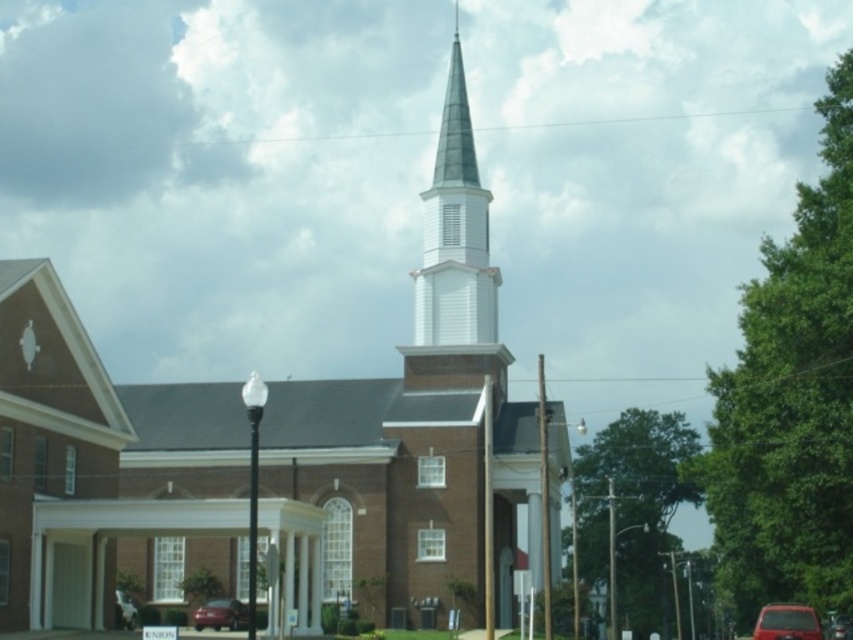
Question: Is the position of white wood steeple at center more distant than that of matte red car at lower right?

Choices:
 (A) no
 (B) yes

Answer: (B)

Question: From the image, what is the correct spatial relationship of white wood steeple at center in relation to matte red car at lower left?

Choices:
 (A) above
 (B) below

Answer: (A)

Question: Which is farther from the brown brick church steeple at center?

Choices:
 (A) metallic silver sedan at center
 (B) white wood steeple at center

Answer: (A)

Question: Among these objects, which one is farthest from the camera?

Choices:
 (A) matte red car at lower right
 (B) metallic silver sedan at center

Answer: (B)

Question: Which point is closer to the camera?

Choices:
 (A) matte red car at lower left
 (B) white wood steeple at center
 (C) brown brick church steeple at center

Answer: (C)

Question: Does brown brick church steeple at center come behind metallic silver sedan at center?

Choices:
 (A) yes
 (B) no

Answer: (B)